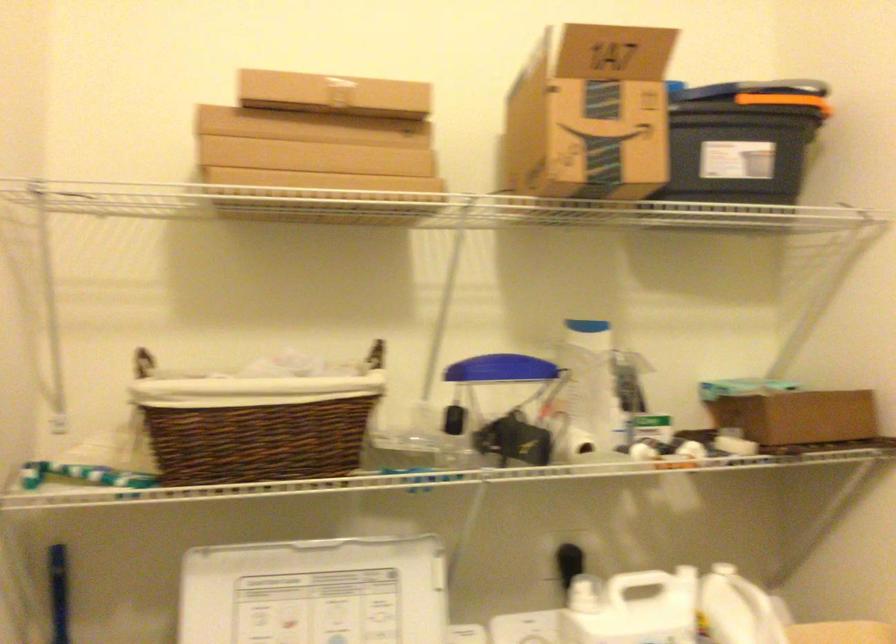
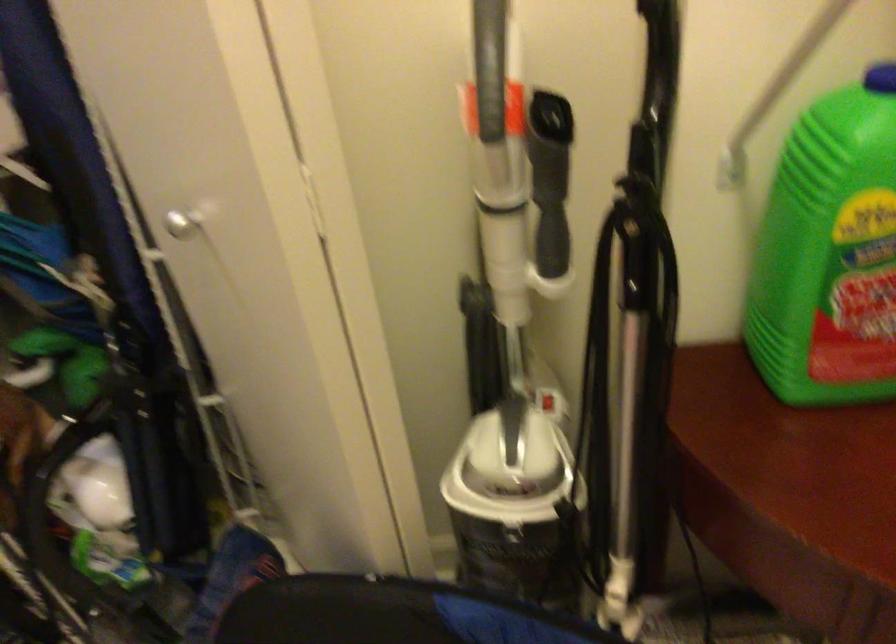
The images are taken continuously from a first-person perspective. In which direction is your viewpoint rotating?

The rotation direction of the camera is right-down.